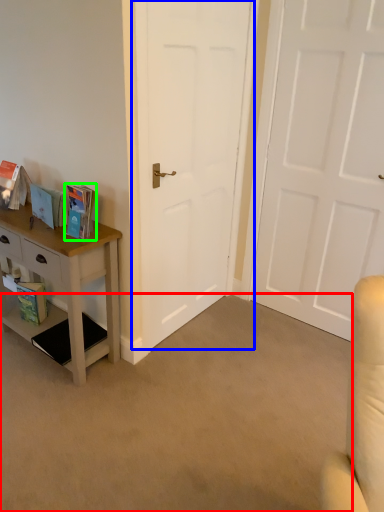
Question: Estimate the real-world distances between objects in this image. Which object is farther from plain (highlighted by a red box), door (highlighted by a blue box) or book (highlighted by a green box)?

Choices:
 (A) door
 (B) book

Answer: (B)